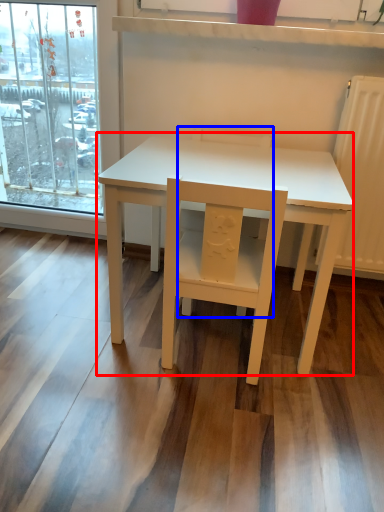
Question: Which object appears closest to the camera in this image, table (highlighted by a red box) or chair (highlighted by a blue box)?

Choices:
 (A) table
 (B) chair

Answer: (A)